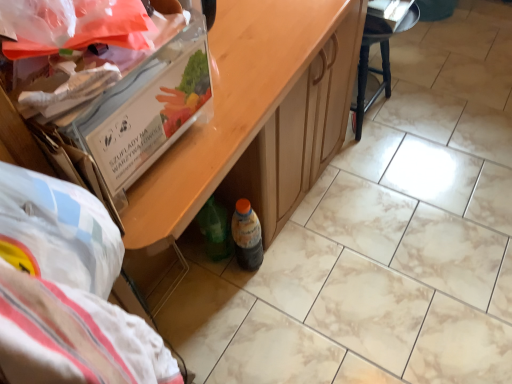
Question: Can you confirm if translucent plastic bottle at lower center is smaller than black wood stool at upper right?

Choices:
 (A) no
 (B) yes

Answer: (B)

Question: Is translucent plastic bottle at lower center to the left of black wood stool at upper right from the viewer's perspective?

Choices:
 (A) yes
 (B) no

Answer: (A)

Question: From a real-world perspective, is translucent plastic bottle at lower center over black wood stool at upper right?

Choices:
 (A) yes
 (B) no

Answer: (B)

Question: Can you confirm if translucent plastic bottle at lower center is wider than black wood stool at upper right?

Choices:
 (A) no
 (B) yes

Answer: (A)

Question: From the image's perspective, does translucent plastic bottle at lower center appear lower than black wood stool at upper right?

Choices:
 (A) no
 (B) yes

Answer: (B)

Question: Is translucent plastic bottle at lower center in front of or behind black wood stool at upper right in the image?

Choices:
 (A) behind
 (B) front

Answer: (B)

Question: From a real-world perspective, is translucent plastic bottle at lower center positioned above or below black wood stool at upper right?

Choices:
 (A) below
 (B) above

Answer: (A)

Question: Considering the positions of translucent plastic bottle at lower center and black wood stool at upper right in the image, is translucent plastic bottle at lower center wider or thinner than black wood stool at upper right?

Choices:
 (A) wide
 (B) thin

Answer: (B)

Question: Visually, is translucent plastic bottle at lower center positioned to the left or to the right of black wood stool at upper right?

Choices:
 (A) right
 (B) left

Answer: (B)

Question: Is wooden table at center to the left or to the right of black wood stool at upper right in the image?

Choices:
 (A) right
 (B) left

Answer: (B)

Question: From a real-world perspective, is wooden table at center physically located above or below black wood stool at upper right?

Choices:
 (A) above
 (B) below

Answer: (A)

Question: In the image, is wooden table at center positioned in front of or behind black wood stool at upper right?

Choices:
 (A) front
 (B) behind

Answer: (A)

Question: Based on their sizes in the image, would you say wooden table at center is bigger or smaller than black wood stool at upper right?

Choices:
 (A) big
 (B) small

Answer: (A)

Question: Is translucent plastic bottle at lower center inside the boundaries of wooden table at center, or outside?

Choices:
 (A) outside
 (B) inside

Answer: (B)

Question: From the image's perspective, is translucent plastic bottle at lower center positioned above or below wooden table at center?

Choices:
 (A) below
 (B) above

Answer: (A)